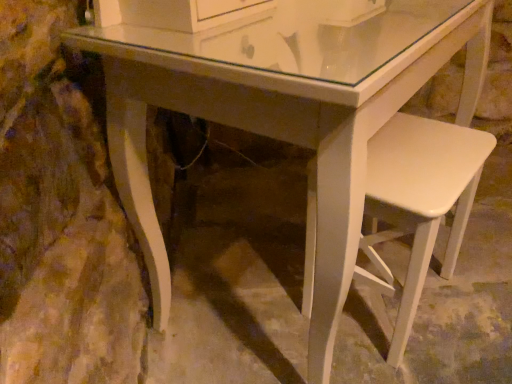
What do you see at coordinates (420, 199) in the screenshot?
I see `white matte wood bar stool at lower right` at bounding box center [420, 199].

The image size is (512, 384). In order to click on white matte wood bar stool at lower right in this screenshot , I will do `click(420, 199)`.

Find the location of a particular element. The height and width of the screenshot is (384, 512). white matte wood bar stool at lower right is located at coordinates (420, 199).